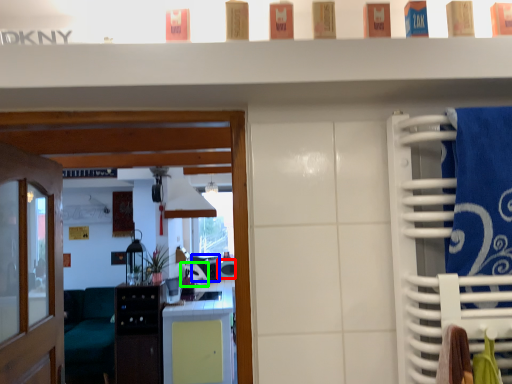
Question: Which is nearer to the appliance (highlighted by a red box)? appliance (highlighted by a blue box) or appliance (highlighted by a green box).

Choices:
 (A) appliance
 (B) appliance

Answer: (A)